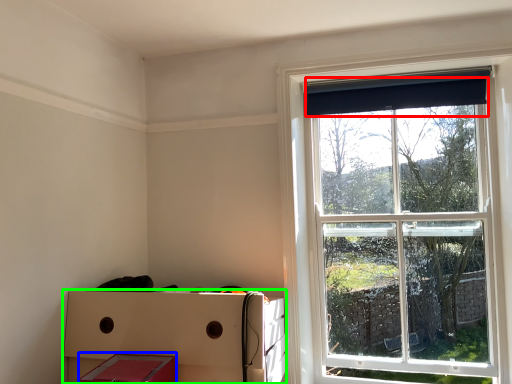
Question: Which object is the closest to the curtain (highlighted by a red box)? Choose among these: storage box (highlighted by a blue box) or crate (highlighted by a green box).

Choices:
 (A) storage box
 (B) crate

Answer: (B)